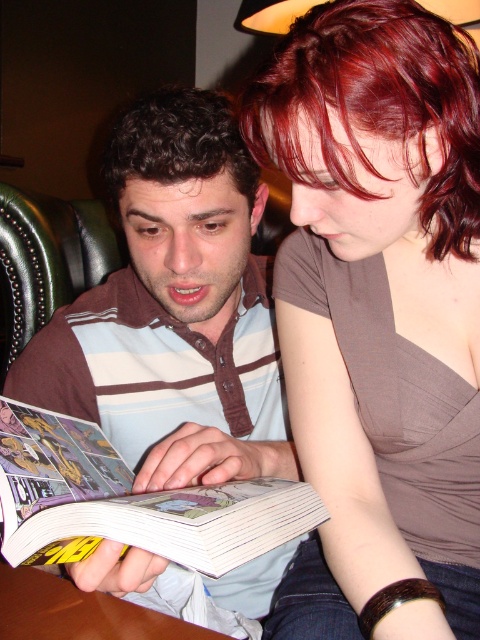
You are standing in front of the comic book and want to place a sticker exactly at point (33, 362). If your hand can reach up to 30 inches, will you be able to reach that point?

The distance between you and point (33, 362) is 31.26 inches, which is beyond your hand reach of 30 inches. You won not be able to reach it.

You are an AI analyzing the spatial coordinates of objects in an image. The scene shows two people reading a comic book. Where is the brown satin blouse at upper right located in terms of its 2D coordinates?

The brown satin blouse at upper right is located at the 2D coordinates of point (379,314).

You are a tailor measuring the distance between two items in the image to create a custom garment. The items are the brown satin blouse at upper right and the brown curly hair at center. The minimum required space for the garment is 9 inches. Can the garment be made with the given measurements?

The distance between the brown satin blouse at upper right and the brown curly hair at center is 8.60 inches, which is less than the required 9 inches. Therefore, the garment cannot be made with the given measurements.